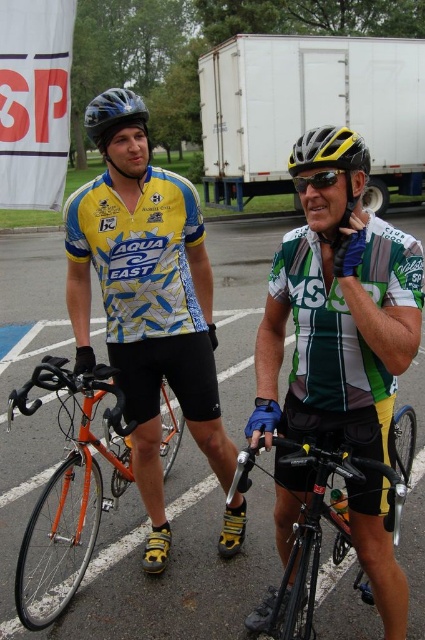
You are a photographer at a cycling event. You need to capture a photo where the matte yellow jersey at left and the matte black helmet at upper left are both visible. Based on their heights, which object should you focus on to ensure both are in frame?

The matte yellow jersey at left is shorter than the matte black helmet at upper left, so focusing on the matte black helmet at upper left will ensure both objects are visible in the frame since the jersey is lower and shorter.

You are a photographer at the event and want to capture both cyclists in a single shot. You notice two points marked in the image. The first point is at coordinate point (37,385) and the second point is at coordinate point (300,148). If you want to ensure both cyclists are fully visible in your photo, which point should you position your camera closer to?

You should position your camera closer to point (300,148) because point (37,385) is behind it, so moving closer to the front point ensures both cyclists are visible.

You are a photographer at the event and want to take a photo of the green and white jersey at center without the white matte trailer truck at upper center appearing in the shot. How can you adjust your position to achieve this?

Move closer to the green and white jersey at center so it blocks the view of the white matte trailer truck at upper center, since the jersey is in front of the truck.